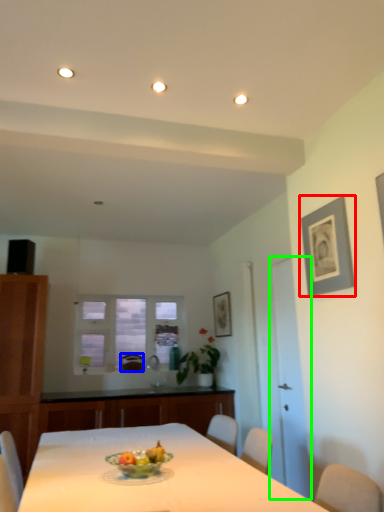
Question: Considering the real-world distances, which object is closest to picture frame (highlighted by a red box)? armchair (highlighted by a blue box) or glass door (highlighted by a green box).

Choices:
 (A) armchair
 (B) glass door

Answer: (B)